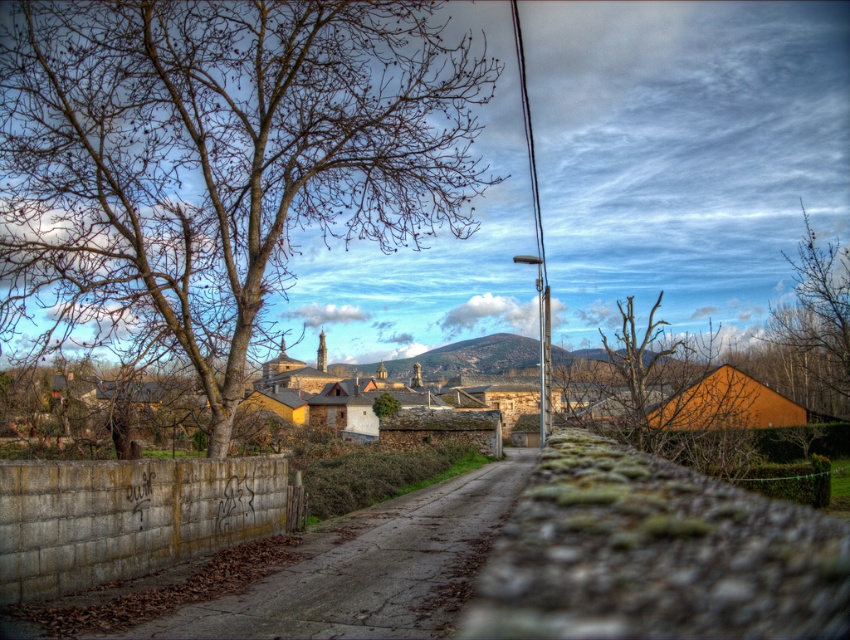
You are an artist trying to sketch the scene. You notice two sets of bare branches in the image. Which set, the bare branches at center or the bare branches at right, appears to have a greater width?

The bare branches at center might be wider than bare branches at right according to the description.